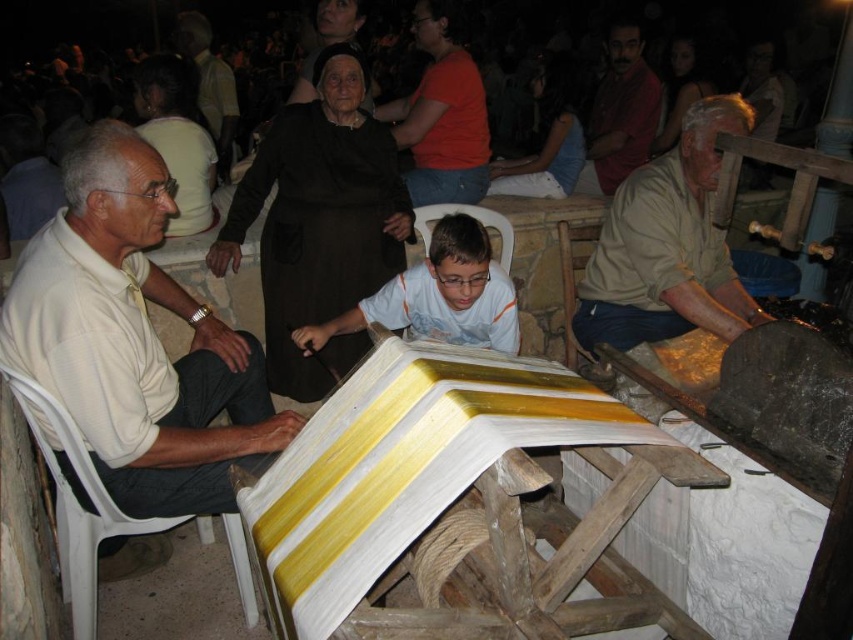
Question: Observing the image, what is the correct spatial positioning of white matte shirt at left in reference to white plastic chair at lower left?

Choices:
 (A) right
 (B) left

Answer: (A)

Question: Among these objects, which one is farthest from the camera?

Choices:
 (A) beige fabric shirt at center
 (B) white plastic chair at lower left
 (C) white plastic chair at center
 (D) wooden chair at lower right

Answer: (C)

Question: Which of the following is the closest to the observer?

Choices:
 (A) dark red shirt at upper right
 (B) white plastic chair at lower left
 (C) beige fabric shirt at center
 (D) white matte shirt at left

Answer: (D)

Question: Estimate the real-world distances between objects in this image. Which object is closer to the wooden chair at lower right?

Choices:
 (A) white plastic chair at lower left
 (B) dark brown leather jacket at upper center

Answer: (A)

Question: Is white matte shirt at left thinner than white plastic chair at center?

Choices:
 (A) no
 (B) yes

Answer: (A)

Question: Is beige fabric shirt at center thinner than white plastic chair at lower left?

Choices:
 (A) yes
 (B) no

Answer: (A)